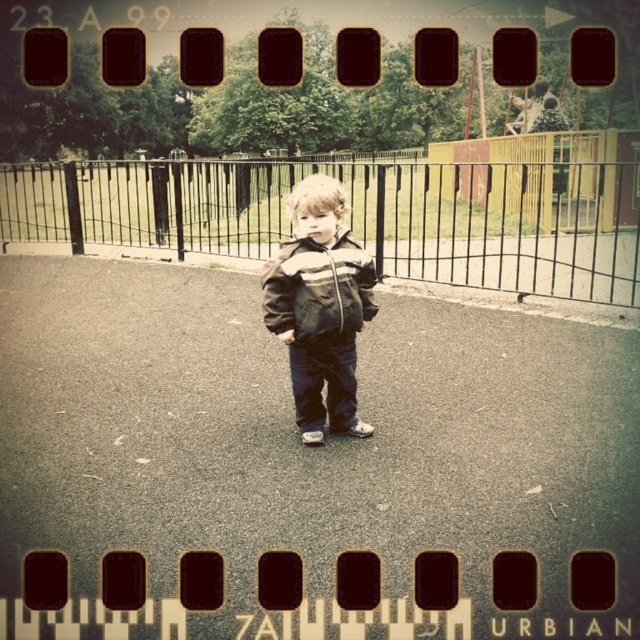
From the picture: You are a photographer trying to capture a shot of the brown textured jacket at center without the black metal fence at center blocking the view. Based on their sizes, is it possible to frame the shot so that the jacket is fully visible while the fence is entirely out of the frame?

The black metal fence at center is bigger than the brown textured jacket at center, so it might be challenging to frame the jacket without the fence appearing in the shot since the fence is larger and likely occupies more space in the image.

You are a photographer trying to capture a photo of the striped fabric jacket at center without including the black metal fence at center in the frame. Based on their sizes, is this possible?

The black metal fence at center has a larger size compared to striped fabric jacket at center, so it is possible to frame the photo to exclude the fence by focusing on the smaller jacket.

You are a photographer trying to capture a shot of the child in the park. You notice the brown textured jacket at center and the striped fabric jacket at center. Which jacket is positioned to the left of the other?

The brown textured jacket at center is positioned to the left of the striped fabric jacket at center.